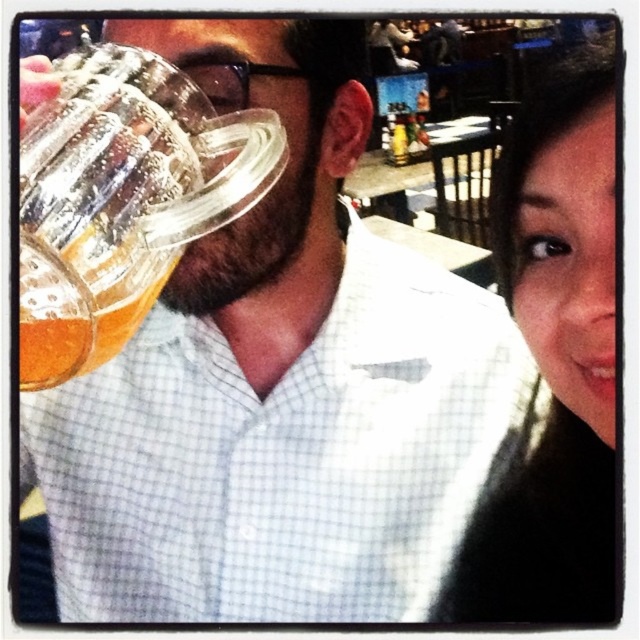
Question: Which of the following is the farthest from the observer?

Choices:
 (A) black hair at upper right
 (B) clear glass mug at left

Answer: (A)

Question: Does black hair at upper right appear over clear glass mug at left?

Choices:
 (A) yes
 (B) no

Answer: (B)

Question: Is black hair at upper right positioned in front of clear glass mug at left?

Choices:
 (A) no
 (B) yes

Answer: (A)

Question: Which point is closer to the camera taking this photo?

Choices:
 (A) (108, 348)
 (B) (582, 564)

Answer: (A)

Question: Where is black hair at upper right located in relation to clear glass mug at left in the image?

Choices:
 (A) left
 (B) right

Answer: (B)